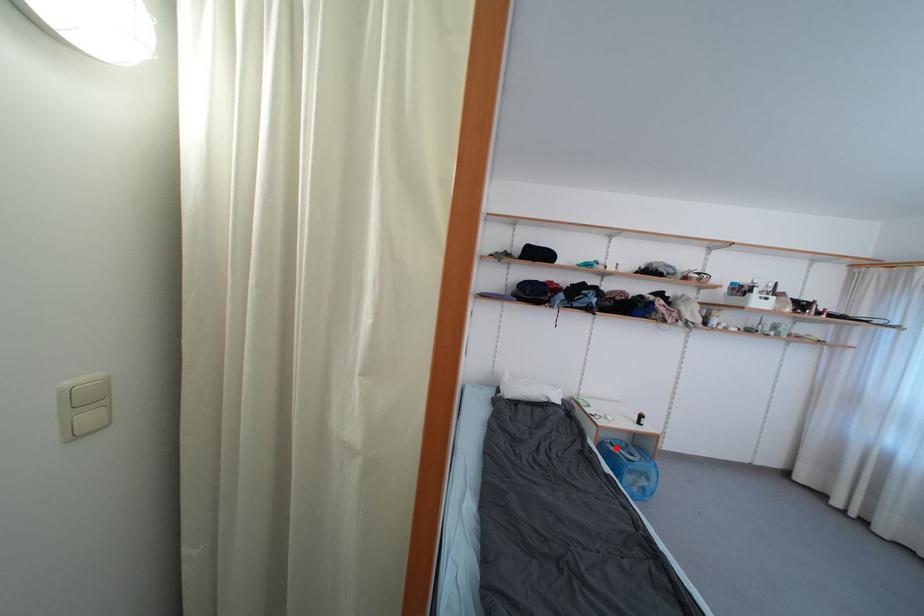
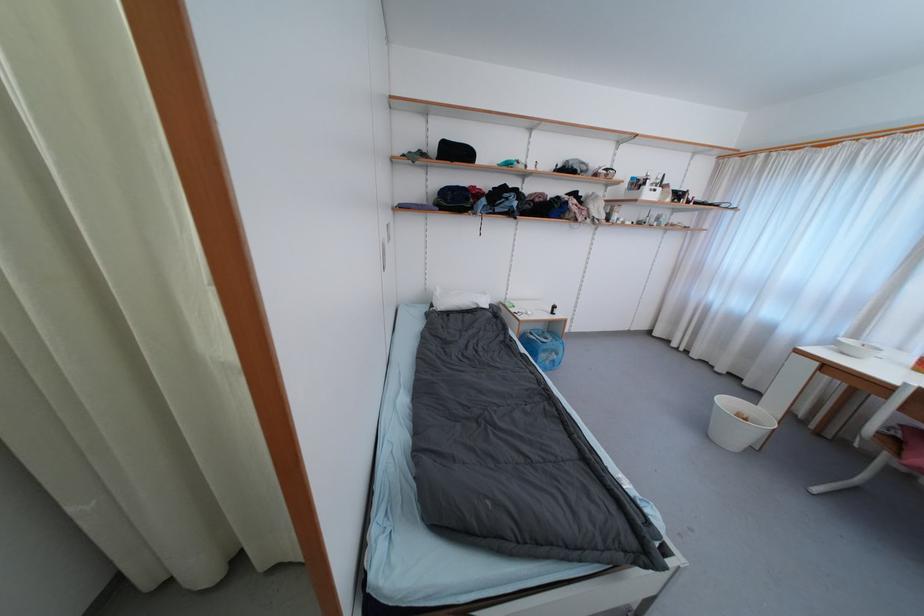
Question: I am providing you with two images of the same scene from different viewpoints. A red point is shown in image1. For the corresponding object point in image2, is it positioned nearer or farther from the camera?

Choices:
 (A) Nearer
 (B) Farther

Answer: (A)